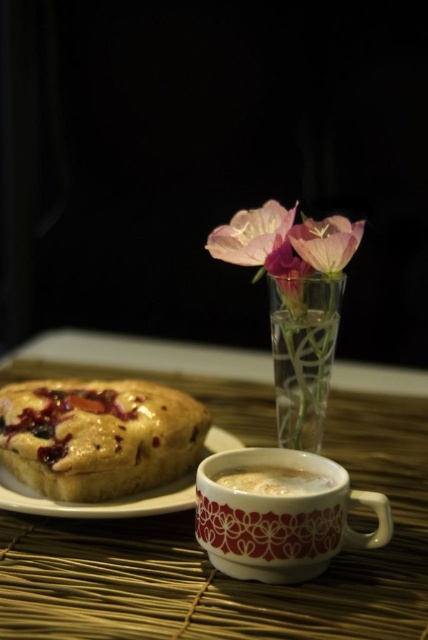
Is white glossy mug at lower center wider than pink translucent flower at center?

Correct, the width of white glossy mug at lower center exceeds that of pink translucent flower at center.

What do you see at coordinates (279, 513) in the screenshot? This screenshot has width=428, height=640. I see `white glossy mug at lower center` at bounding box center [279, 513].

You are a GUI agent. You are given a task and a screenshot of the screen. Output one action in this format:
    pyautogui.click(x=<x>, y=<y>)
    Task: Click on the white glossy mug at lower center
    
    Given the screenshot: What is the action you would take?
    pyautogui.click(x=279, y=513)

The height and width of the screenshot is (640, 428). In order to click on white glossy mug at lower center in this screenshot , I will do `click(279, 513)`.

In the scene shown: Can you confirm if pink translucent vase at upper center is positioned to the right of white glossy saucer at lower left?

Correct, you'll find pink translucent vase at upper center to the right of white glossy saucer at lower left.

At what (x,y) coordinates should I click in order to perform the action: click on pink translucent vase at upper center. Please return your answer as a coordinate pair (x, y). Looking at the image, I should click on [x=287, y=246].

Which is in front, point (269, 216) or point (2, 493)?

Point (2, 493) is more forward.

The width and height of the screenshot is (428, 640). In order to click on pink translucent vase at upper center in this screenshot , I will do `click(287, 246)`.

Can you confirm if white glossy mug at lower center is positioned to the right of white frothy coffee at center?

Yes, white glossy mug at lower center is to the right of white frothy coffee at center.

Between point (199, 467) and point (273, 492), which one is positioned in front?

Point (273, 492) is more forward.

Who is more forward, (329, 490) or (265, 484)?

Point (329, 490) is in front.

The height and width of the screenshot is (640, 428). In order to click on white glossy mug at lower center in this screenshot , I will do `click(279, 513)`.